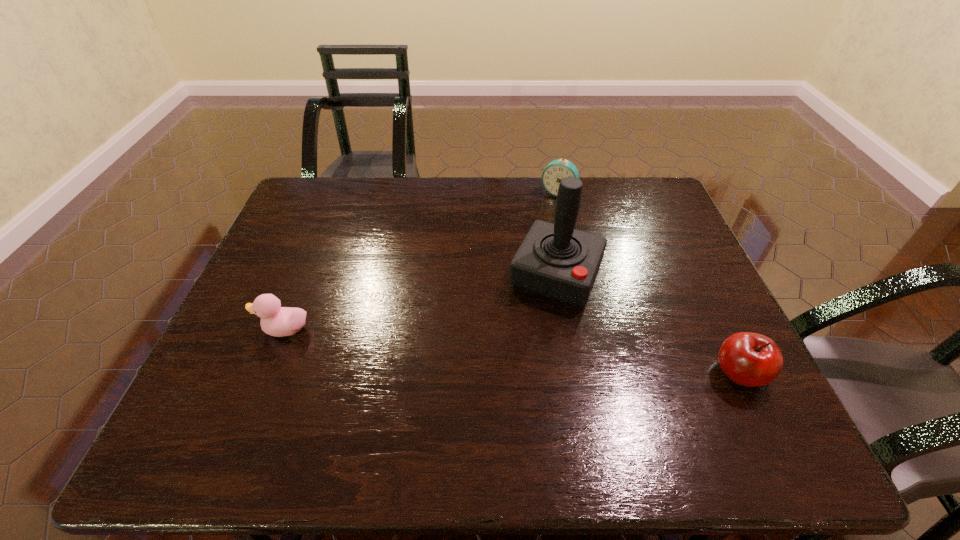
Where is `free space on the desktop that is between the duckling and the rightmost object and is positioned on the front-facing side of the farthest object`? The image size is (960, 540). free space on the desktop that is between the duckling and the rightmost object and is positioned on the front-facing side of the farthest object is located at coordinates (470, 348).

Where is `vacant space on the desktop that is between the shortest object and the apple and is positioned on the base of the joystick`? vacant space on the desktop that is between the shortest object and the apple and is positioned on the base of the joystick is located at coordinates (520, 353).